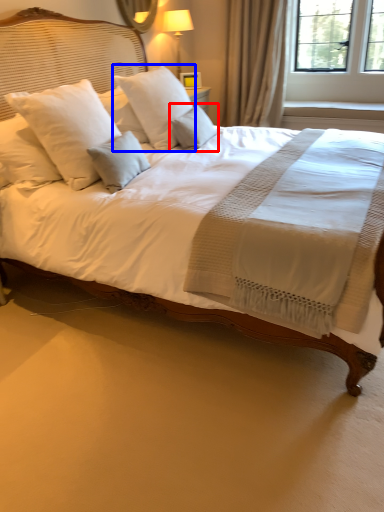
Question: Which object appears closest to the camera in this image, pillow (highlighted by a red box) or pillow (highlighted by a blue box)?

Choices:
 (A) pillow
 (B) pillow

Answer: (B)